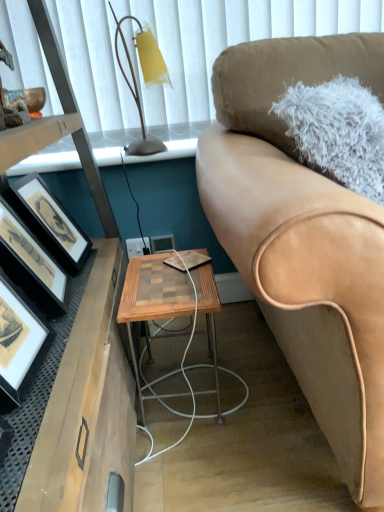
Question: From the image's perspective, is tan leather couch at right located beneath wooden desk at left?

Choices:
 (A) no
 (B) yes

Answer: (A)

Question: Is tan leather couch at right not inside wooden desk at left?

Choices:
 (A) yes
 (B) no

Answer: (A)

Question: Is tan leather couch at right surrounding wooden desk at left?

Choices:
 (A) no
 (B) yes

Answer: (A)

Question: Considering the relative positions of tan leather couch at right and wooden desk at left in the image provided, is tan leather couch at right in front of wooden desk at left?

Choices:
 (A) no
 (B) yes

Answer: (A)

Question: Is tan leather couch at right to the right of wooden desk at left from the viewer's perspective?

Choices:
 (A) yes
 (B) no

Answer: (A)

Question: From a real-world perspective, relative to matte black picture frame at left, which is the third picture frame in right-to-left order, is tan leather couch at right vertically above or below?

Choices:
 (A) below
 (B) above

Answer: (B)

Question: From the image's perspective, is tan leather couch at right positioned above or below matte black picture frame at left, which appears as the first picture frame when viewed from the left?

Choices:
 (A) below
 (B) above

Answer: (B)

Question: Is point (369, 292) closer or farther from the camera than point (39, 230)?

Choices:
 (A) closer
 (B) farther

Answer: (A)

Question: Looking at the image, does tan leather couch at right seem bigger or smaller compared to matte black picture frame at left, which is the third picture frame in right-to-left order?

Choices:
 (A) big
 (B) small

Answer: (A)

Question: From the image's perspective, is wooden picture frame at center, acting as the 3th picture frame starting from the front, positioned above or below tan leather couch at right?

Choices:
 (A) above
 (B) below

Answer: (B)

Question: Is wooden picture frame at center, which appears as the 1th picture frame when viewed from the right, situated inside tan leather couch at right or outside?

Choices:
 (A) inside
 (B) outside

Answer: (B)

Question: Is point (152, 242) closer or farther from the camera than point (331, 392)?

Choices:
 (A) farther
 (B) closer

Answer: (A)

Question: Considering the relative positions of wooden picture frame at center, arranged as the first picture frame when viewed from the back, and tan leather couch at right in the image provided, is wooden picture frame at center, arranged as the first picture frame when viewed from the back, to the left or to the right of tan leather couch at right?

Choices:
 (A) right
 (B) left

Answer: (B)

Question: Is tan leather couch at right taller or shorter than matte black picture frame at left, positioned as the second picture frame in right-to-left order?

Choices:
 (A) tall
 (B) short

Answer: (A)

Question: Is tan leather couch at right in front of or behind matte black picture frame at left, placed as the first picture frame when sorted from front to back, in the image?

Choices:
 (A) behind
 (B) front

Answer: (B)